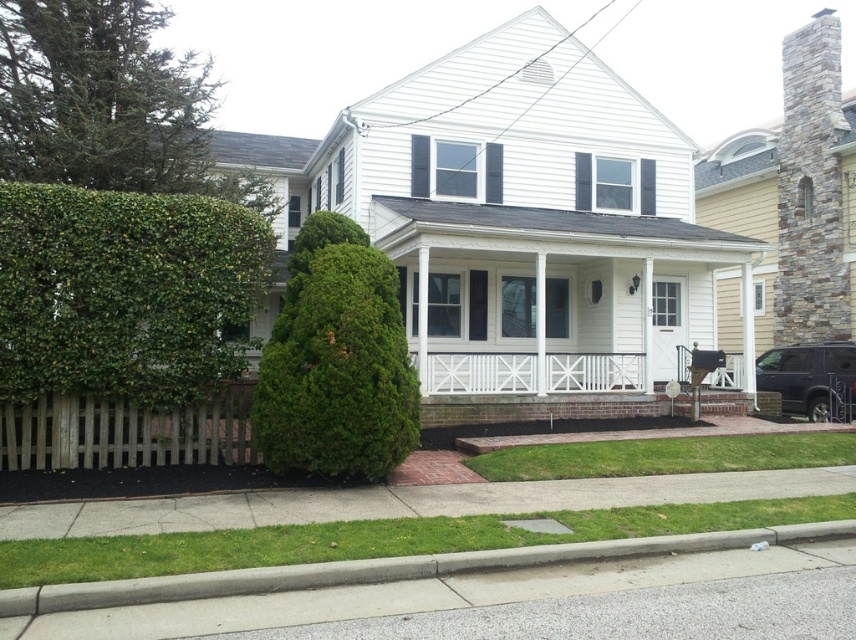
Question: Observing the image, what is the correct spatial positioning of green leafy hedge at left in reference to green textured hedge at center?

Choices:
 (A) left
 (B) right

Answer: (A)

Question: Which point appears farthest from the camera in this image?

Choices:
 (A) (119, 250)
 (B) (183, 596)

Answer: (A)

Question: Which of these objects is positioned farthest from the green leafy hedge at left?

Choices:
 (A) gray concrete curb at lower center
 (B) green textured hedge at center

Answer: (A)

Question: Does green textured hedge at center have a lesser width compared to gray concrete curb at lower center?

Choices:
 (A) yes
 (B) no

Answer: (B)

Question: Is green leafy hedge at left positioned behind gray concrete curb at lower center?

Choices:
 (A) no
 (B) yes

Answer: (B)

Question: Which of the following is the closest to the observer?

Choices:
 (A) gray concrete curb at lower center
 (B) green textured hedge at center
 (C) green leafy hedge at left

Answer: (A)